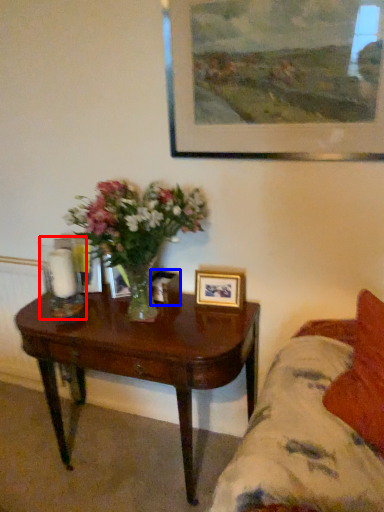
Question: Which of the following is the farthest to the observer, candle holder (highlighted by a red box) or picture frame (highlighted by a blue box)?

Choices:
 (A) candle holder
 (B) picture frame

Answer: (B)